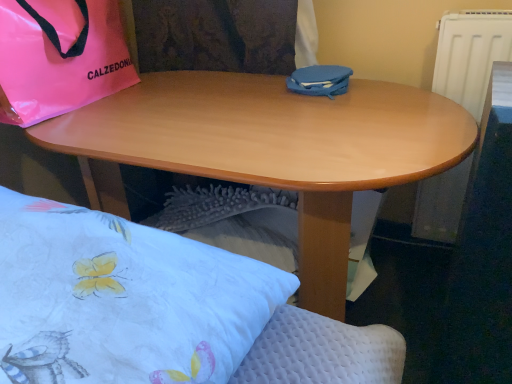
Question: Considering the relative sizes of white quilted pillow at lower left and blue matte case at center in the image provided, is white quilted pillow at lower left wider than blue matte case at center?

Choices:
 (A) no
 (B) yes

Answer: (B)

Question: Is white quilted pillow at lower left not close to blue matte case at center?

Choices:
 (A) no
 (B) yes

Answer: (A)

Question: Does white quilted pillow at lower left have a larger size compared to blue matte case at center?

Choices:
 (A) yes
 (B) no

Answer: (A)

Question: From a real-world perspective, is white quilted pillow at lower left positioned over blue matte case at center based on gravity?

Choices:
 (A) yes
 (B) no

Answer: (B)

Question: Does white quilted pillow at lower left turn towards blue matte case at center?

Choices:
 (A) no
 (B) yes

Answer: (A)

Question: Is blue matte case at center taller or shorter than wooden desk at center?

Choices:
 (A) tall
 (B) short

Answer: (B)

Question: From the image's perspective, is blue matte case at center positioned above or below wooden desk at center?

Choices:
 (A) below
 (B) above

Answer: (B)

Question: Would you say blue matte case at center is to the left or to the right of wooden desk at center in the picture?

Choices:
 (A) right
 (B) left

Answer: (A)

Question: From a real-world perspective, is blue matte case at center physically located above or below wooden desk at center?

Choices:
 (A) above
 (B) below

Answer: (A)

Question: Which is correct: wooden desk at center is inside white quilted pillow at lower left, or outside of it?

Choices:
 (A) outside
 (B) inside

Answer: (A)

Question: Relative to white quilted pillow at lower left, is wooden desk at center in front or behind?

Choices:
 (A) behind
 (B) front

Answer: (A)

Question: From a real-world perspective, is wooden desk at center positioned above or below white quilted pillow at lower left?

Choices:
 (A) below
 (B) above

Answer: (A)

Question: In the image, is wooden desk at center on the left side or the right side of white quilted pillow at lower left?

Choices:
 (A) left
 (B) right

Answer: (B)

Question: Considering the positions of point (x=187, y=147) and point (x=110, y=86), is point (x=187, y=147) closer or farther from the camera than point (x=110, y=86)?

Choices:
 (A) closer
 (B) farther

Answer: (A)

Question: In the image, is wooden desk at center positioned in front of or behind pink glossy bag at upper left?

Choices:
 (A) behind
 (B) front

Answer: (B)